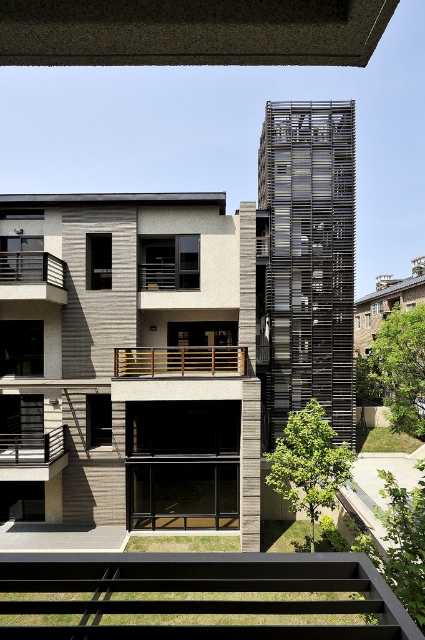
You are standing in front of the modern residential building and want to take a photo. You notice two points marked on the building facade at coordinates point (25, 275) and point (10, 477). Which point is closer to your camera lens when taking the photo?

Point (10, 477) is closer to the camera lens because it is less further away than point (25, 275), which is positioned further away from the camera.

You are standing in front of the modern residential building. There is a point at coordinates [180,360]. Based on the scene description, where is this point located?

The point at [180,360] is located on the wooden railing at center.